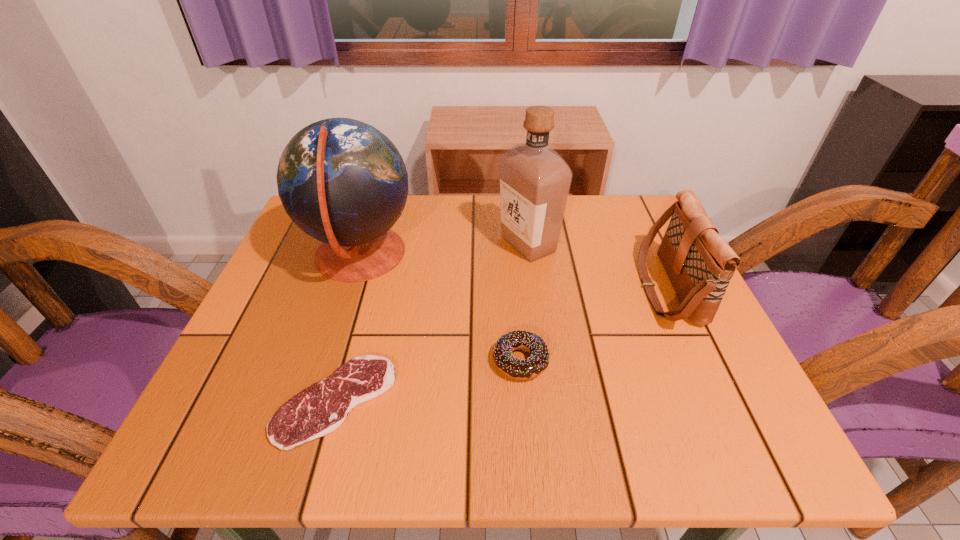
The height and width of the screenshot is (540, 960). Identify the location of free space between the steak and the second shortest object. (428, 381).

Image resolution: width=960 pixels, height=540 pixels. I want to click on vacant space that is in between the globe and the shortest object, so pyautogui.click(x=348, y=328).

At what (x,y) coordinates should I click in order to perform the action: click on vacant point located between the shoulder bag and the second shortest object. Please return your answer as a coordinate pair (x, y). Looking at the image, I should click on (594, 325).

Image resolution: width=960 pixels, height=540 pixels. Identify the location of free space between the globe and the liquor. (444, 250).

What are the coordinates of `empty location between the globe and the steak` in the screenshot? It's located at (348, 328).

I want to click on empty space between the shortest object and the doughnut, so click(x=428, y=381).

At what (x,y) coordinates should I click in order to perform the action: click on free space between the shortest object and the doughnut. Please return your answer as a coordinate pair (x, y). Looking at the image, I should click on (428, 381).

Locate an element on the screen. Image resolution: width=960 pixels, height=540 pixels. unoccupied position between the shortest object and the liquor is located at coordinates (432, 322).

Locate an element on the screen. vacant area between the globe and the liquor is located at coordinates (444, 250).

The width and height of the screenshot is (960, 540). I want to click on vacant space in between the second shortest object and the shoulder bag, so click(x=594, y=325).